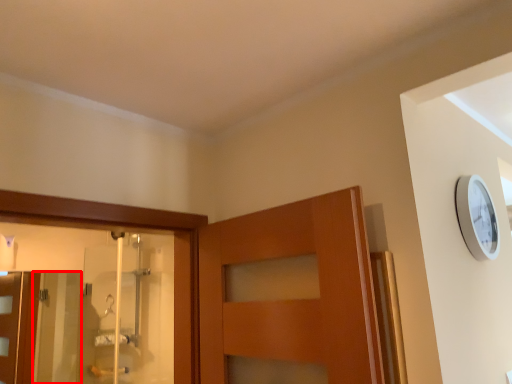
Question: From the image's perspective, where is screen door (annotated by the red box) located in relation to screen door in the image?

Choices:
 (A) below
 (B) above

Answer: (A)